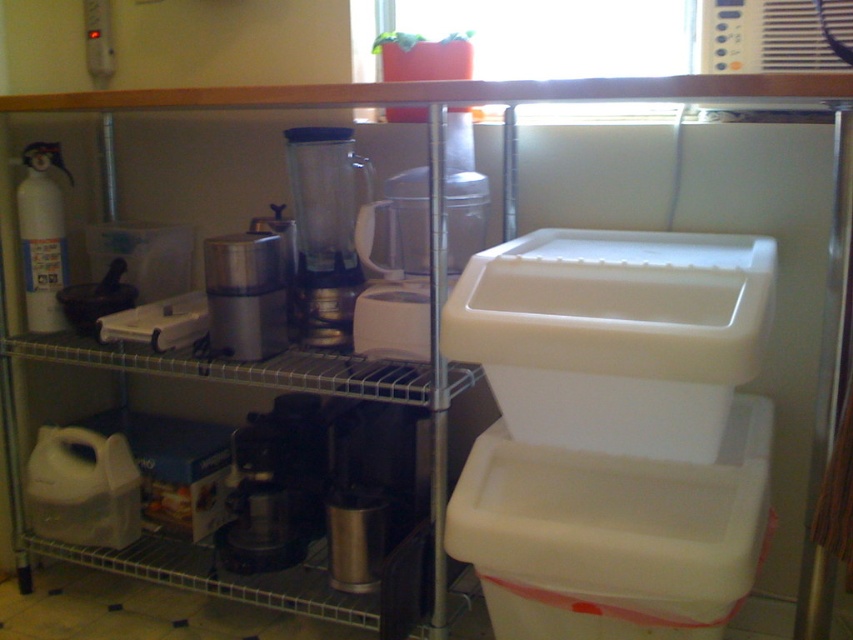
Who is more forward, (503, 429) or (247, 240)?

Point (503, 429)

How far apart are white plastic container at center right and satin silver appliance at center?

white plastic container at center right is 23.92 inches away from satin silver appliance at center.

Which is in front, point (688, 609) or point (235, 317)?

Point (688, 609)

Where is `white plastic container at center right`? The width and height of the screenshot is (853, 640). white plastic container at center right is located at coordinates (613, 534).

What do you see at coordinates (326, 228) in the screenshot? I see `clear plastic blender at center` at bounding box center [326, 228].

Describe the element at coordinates (326, 228) in the screenshot. I see `clear plastic blender at center` at that location.

I want to click on clear plastic blender at center, so click(326, 228).

Can you confirm if white plastic container at center right is positioned below clear plastic blender at center?

Yes, white plastic container at center right is below clear plastic blender at center.

Looking at this image, who is more distant from viewer, (741,403) or (361,179)?

The point (361,179) is more distant.

Identify the location of white plastic container at center right. (613, 534).